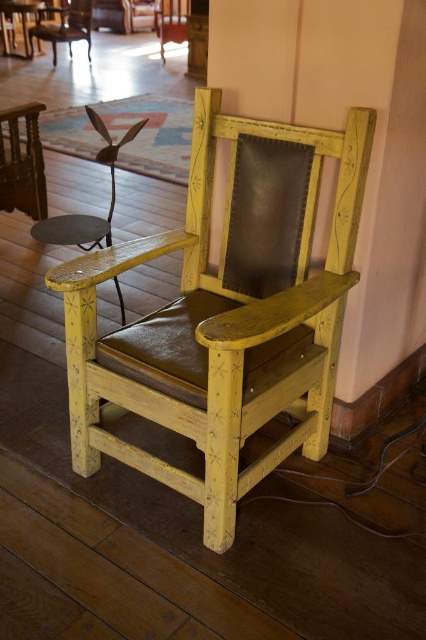
You are arranging a small living room and need to place a lamp on the floor between the yellow painted wood chair at center and the yellow painted wood armchair at center. According to the scene description, which object is lower to the ground so the lamp can be placed near it?

The yellow painted wood chair at center is below the yellow painted wood armchair at center, so the lamp should be placed near the yellow painted wood chair at center since it is lower to the ground.

You are a guest entering the room and see the yellow painted wood chair at center and the yellow painted wood armchair at center. Which one do you think is taller?

The yellow painted wood chair at center is much taller than the yellow painted wood armchair at center.

You are a furniture designer who needs to place a new sofa that is 2 meters wide in the same room as the yellow painted wood chair at center and the yellow painted wood armchair at center. Given their positions, will there be enough space between them to fit the sofa?

The yellow painted wood chair at center and the yellow painted wood armchair at center are 6.45 meters apart. Since the sofa is only 2 meters wide, there is sufficient space between them to accommodate the sofa.